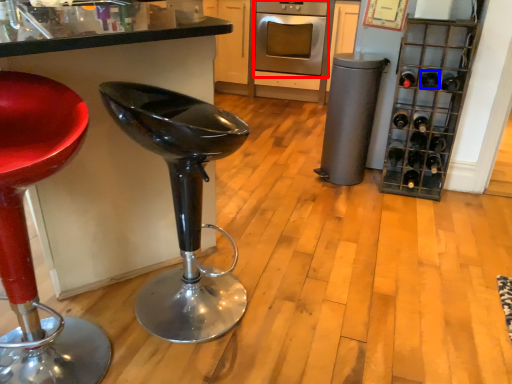
Question: Which object appears farthest to the camera in this image, oven (highlighted by a red box) or wine bottle (highlighted by a blue box)?

Choices:
 (A) oven
 (B) wine bottle

Answer: (A)